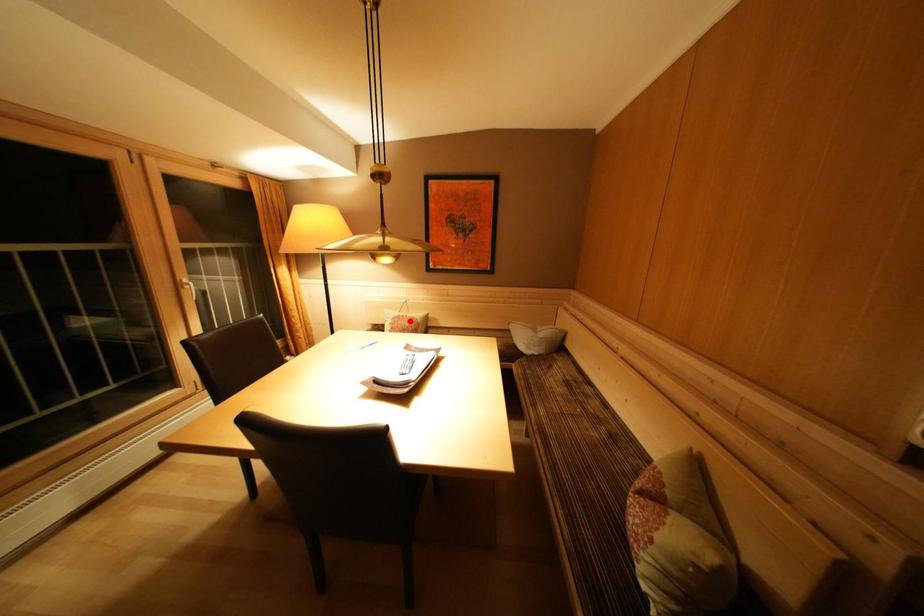
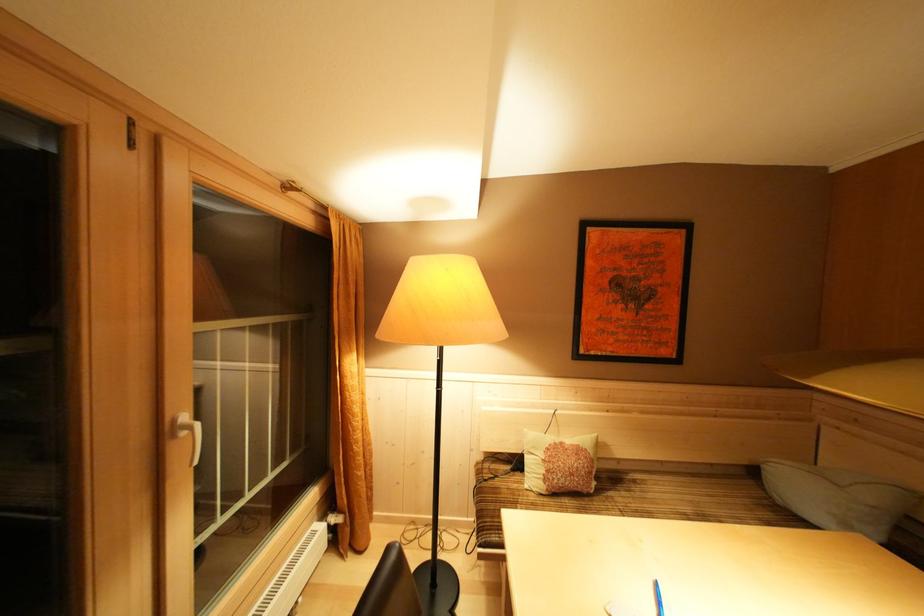
In the second image, find the point that corresponds to the highlighted location in the first image.

(568, 448)